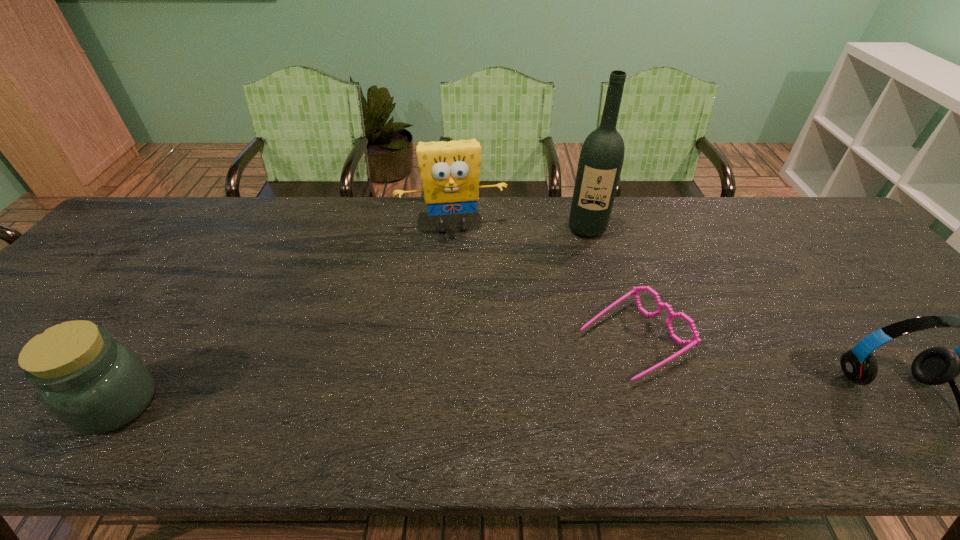
Where is `free space located 0.110m on the arms of the shortest object`? This screenshot has height=540, width=960. free space located 0.110m on the arms of the shortest object is located at coordinates (555, 386).

This screenshot has height=540, width=960. I want to click on vacant space situated on the arms of the shortest object, so click(x=576, y=374).

The image size is (960, 540). What are the coordinates of `vacant space positioned 0.400m on the face of the fourth object from right to left` in the screenshot? It's located at (474, 350).

Image resolution: width=960 pixels, height=540 pixels. Find the location of `blank space located 0.180m on the face of the fourth object from right to left`. blank space located 0.180m on the face of the fourth object from right to left is located at coordinates (465, 284).

Identify the location of free space located 0.260m on the face of the fourth object from right to left. (468, 306).

In order to click on wine bottle that is positioned at the far edge in this screenshot , I will do `click(602, 154)`.

Locate an element on the screen. The height and width of the screenshot is (540, 960). sponge at the far edge is located at coordinates (450, 171).

This screenshot has height=540, width=960. Find the location of `jar at the near edge`. jar at the near edge is located at coordinates (94, 385).

The width and height of the screenshot is (960, 540). What are the coordinates of `spectacles positioned at the near edge` in the screenshot? It's located at (696, 340).

At what (x,y) coordinates should I click in order to perform the action: click on free space at the far edge of the desktop. Please return your answer as a coordinate pair (x, y). This screenshot has height=540, width=960. Looking at the image, I should click on (512, 213).